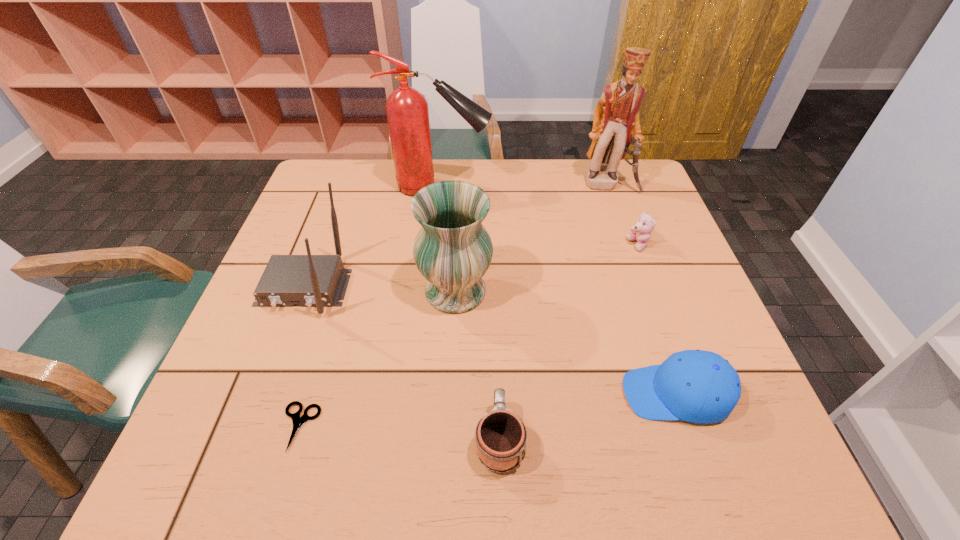
This screenshot has width=960, height=540. What are the coordinates of `free space between the fire extinguisher and the router` in the screenshot? It's located at (372, 237).

At what (x,y) coordinates should I click in order to perform the action: click on vacant area between the shears and the vase. Please return your answer as a coordinate pair (x, y). The image size is (960, 540). Looking at the image, I should click on (377, 359).

You are a GUI agent. You are given a task and a screenshot of the screen. Output one action in this format:
    pyautogui.click(x=<x>, y=<y>)
    Task: Click on the empty space between the fire extinguisher and the cap
    This screenshot has width=960, height=540.
    Given the screenshot: What is the action you would take?
    pyautogui.click(x=558, y=290)

Locate an element on the screen. The width and height of the screenshot is (960, 540). vacant point located between the vase and the cap is located at coordinates (565, 342).

Locate an element on the screen. free space between the vase and the mug is located at coordinates (477, 365).

Locate an element on the screen. The height and width of the screenshot is (540, 960). free point between the teddy bear and the nutcracker is located at coordinates (623, 214).

This screenshot has height=540, width=960. I want to click on vacant area that lies between the cap and the teddy bear, so click(658, 319).

You are a GUI agent. You are given a task and a screenshot of the screen. Output one action in this format:
    pyautogui.click(x=<x>, y=<y>)
    Task: Click on the empty space that is in between the fire extinguisher and the nutcracker
    Image resolution: width=960 pixels, height=540 pixels.
    Given the screenshot: What is the action you would take?
    pyautogui.click(x=524, y=185)

Identify the location of object that is the nearest to the second shortest object. This screenshot has width=960, height=540. (697, 386).

Identify which object is located as the nearest to the router. Please provide its 2D coordinates. Your answer should be formatted as a tuple, i.e. [(x, y)], where the tuple contains the x and y coordinates of a point satisfying the conditions above.

[(452, 250)]